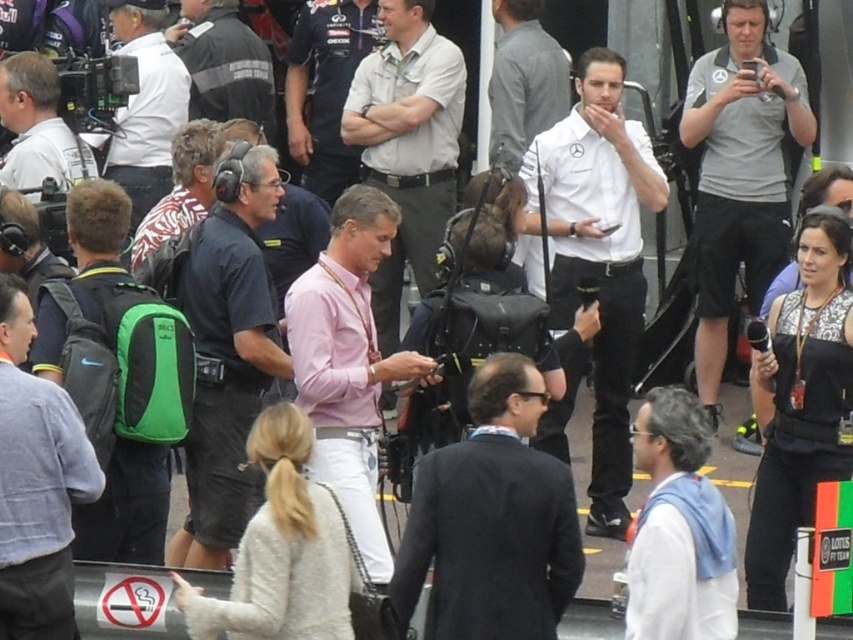
Based on the photo, you are a photographer at the event and need to capture a wide shot that includes both the light gray shirt at center and the white matte jacket at upper left. Given their sizes in the frame, which subject will appear smaller in the photo?

The light gray shirt at center will appear smaller in the photo since it occupies less space than the white matte jacket at upper left according to the description.

You are a photographer at the motorsport event. You want to take a photo of both the dark blue suit at center and the gray shirt at center. However, you notice that one of them is blocking the other. Which one is blocking the other?

The dark blue suit at center is blocking the gray shirt at center because it is in front of it.

You are a photographer positioned at the edge of the pit lane. You need to capture a photo of both the dark blue suit at center and the gray shirt at center in the same frame. Given that your camera has a maximum focus range of 15 meters, will you be able to include both subjects in focus without moving your position?

The dark blue suit at center is 14.17 meters away from the gray shirt at center. Since the maximum focus range of your camera is 15 meters, and the distance between them is within this range, you can capture both subjects in focus without moving your position.